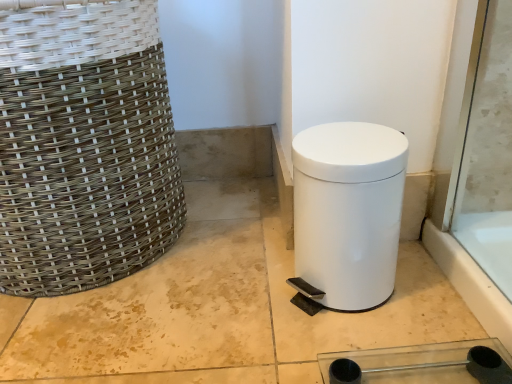
Locate an element on the screen. free spot in front of white glossy trash can at lower right is located at coordinates (352, 348).